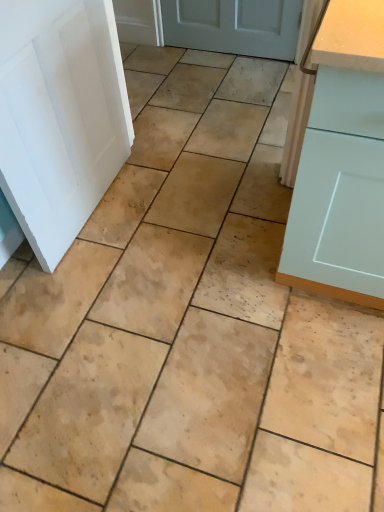
In order to click on light blue matte cabinet at right in this screenshot , I will do `click(329, 220)`.

This screenshot has width=384, height=512. What do you see at coordinates (329, 220) in the screenshot?
I see `light blue matte cabinet at right` at bounding box center [329, 220].

At what (x,y) coordinates should I click in order to perform the action: click on white matte door at left. Please return your answer as a coordinate pair (x, y). The width and height of the screenshot is (384, 512). Looking at the image, I should click on (60, 116).

The height and width of the screenshot is (512, 384). What do you see at coordinates (60, 116) in the screenshot?
I see `white matte door at left` at bounding box center [60, 116].

What is the approximate height of white matte door at left?

34.87 inches.

The image size is (384, 512). What are the coordinates of `light blue matte cabinet at right` in the screenshot? It's located at (329, 220).

In the image, is light blue matte cabinet at right on the left side or the right side of white matte door at left?

Based on their positions, light blue matte cabinet at right is located to the right of white matte door at left.

Is light blue matte cabinet at right in front of or behind white matte door at left in the image?

light blue matte cabinet at right is in front of white matte door at left.

Between point (310, 203) and point (19, 145), which one is positioned in front?

Positioned in front is point (310, 203).

In the scene shown: From the image's perspective, which is above, light blue matte cabinet at right or white matte door at left?

From the image's view, white matte door at left is above.

From a real-world perspective, is light blue matte cabinet at right positioned under white matte door at left based on gravity?

Yes, from a real-world perspective, light blue matte cabinet at right is under white matte door at left.

Can you confirm if light blue matte cabinet at right is wider than white matte door at left?

Correct, the width of light blue matte cabinet at right exceeds that of white matte door at left.

Between light blue matte cabinet at right and white matte door at left, which one has more height?

light blue matte cabinet at right.

Which of these two, light blue matte cabinet at right or white matte door at left, is bigger?

light blue matte cabinet at right is bigger.

Which is correct: light blue matte cabinet at right is inside white matte door at left, or outside of it?

light blue matte cabinet at right is not enclosed by white matte door at left.

Is light blue matte cabinet at right next to white matte door at left and touching it?

There is a gap between light blue matte cabinet at right and white matte door at left.

Is light blue matte cabinet at right oriented away from white matte door at left?

No.

Identify the location of door above the light blue matte cabinet at right (from the image's perspective). Image resolution: width=384 pixels, height=512 pixels. (60, 116).

Based on their positions, is white matte door at left located to the left or right of light blue matte cabinet at right?

From the image, it's evident that white matte door at left is to the left of light blue matte cabinet at right.

Which object is further away from the camera, white matte door at left or light blue matte cabinet at right?

white matte door at left is more distant.

Between point (25, 92) and point (313, 181), which one is positioned in front?

Point (313, 181)

From the image's perspective, is white matte door at left above light blue matte cabinet at right?

Correct, white matte door at left appears higher than light blue matte cabinet at right in the image.

From a real-world perspective, which object stands above the other?

white matte door at left.

Is white matte door at left thinner than light blue matte cabinet at right?

Correct, the width of white matte door at left is less than that of light blue matte cabinet at right.

Who is shorter, white matte door at left or light blue matte cabinet at right?

With less height is white matte door at left.

Between white matte door at left and light blue matte cabinet at right, which one has smaller size?

white matte door at left is smaller.

Choose the correct answer: Is white matte door at left inside light blue matte cabinet at right or outside it?

The correct answer is: outside.

Are white matte door at left and light blue matte cabinet at right making contact?

No, white matte door at left is not in contact with light blue matte cabinet at right.

Is white matte door at left oriented towards light blue matte cabinet at right?

Yes, white matte door at left is oriented towards light blue matte cabinet at right.

At what (x,y) coordinates should I click in order to perform the action: click on cabinetry located in front of the white matte door at left. Please return your answer as a coordinate pair (x, y). The image size is (384, 512). Looking at the image, I should click on tap(329, 220).

What are the coordinates of `door behind the light blue matte cabinet at right` in the screenshot? It's located at (60, 116).

Where is `cabinetry that is under the white matte door at left (from a real-world perspective)`? cabinetry that is under the white matte door at left (from a real-world perspective) is located at coordinates (329, 220).